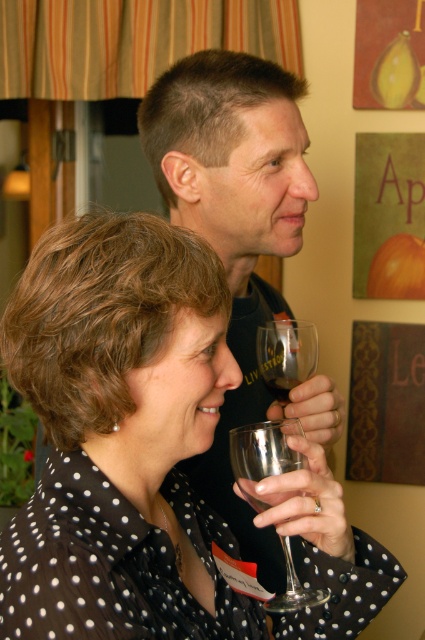
Is point (22, 340) in front of point (272, 390)?

That is True.

Does black dotted shirt at center have a smaller size compared to clear glass wine at center?

No, black dotted shirt at center is not smaller than clear glass wine at center.

Which is in front, point (207, 305) or point (282, 403)?

Point (207, 305) is more forward.

Where is `black dotted shirt at center`? The height and width of the screenshot is (640, 425). black dotted shirt at center is located at coordinates (121, 436).

Identify the location of black dotted shirt at center. (121, 436).

Which is below, black dotted shirt at center or matte black shirt at upper center?

black dotted shirt at center

This screenshot has height=640, width=425. I want to click on black dotted shirt at center, so click(121, 436).